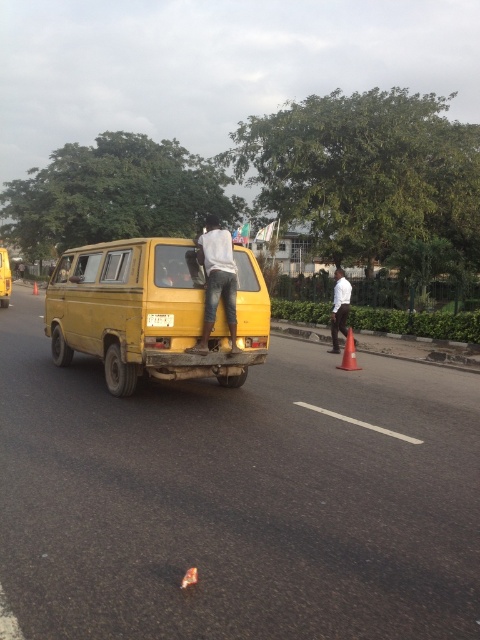
Question: Which point appears farthest from the camera in this image?

Choices:
 (A) (2, 307)
 (B) (346, 333)

Answer: (A)

Question: Which object is closer to the camera taking this photo?

Choices:
 (A) orange matte traffic cone at center
 (B) yellow matte van at center

Answer: (B)

Question: Does yellow matte van at center come behind yellow matte taxi at center?

Choices:
 (A) no
 (B) yes

Answer: (A)

Question: Is light gray jeans at rear behind orange matte traffic cone at right?

Choices:
 (A) yes
 (B) no

Answer: (B)

Question: Can you confirm if yellow matte taxi at center is positioned to the right of yellow matte license plate at rear?

Choices:
 (A) no
 (B) yes

Answer: (A)

Question: Which object is the closest to the white smooth shirt at right?

Choices:
 (A) yellow matte van at center
 (B) light gray jeans at rear
 (C) yellow matte taxi at center

Answer: (A)